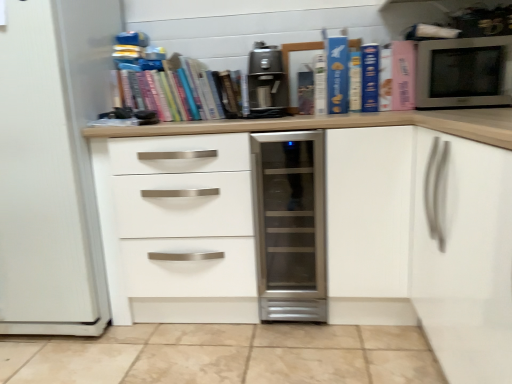
Describe the element at coordinates (370, 78) in the screenshot. The height and width of the screenshot is (384, 512). I see `blue matte book at upper center, which ranks as the 3th paperback book in right-to-left order` at that location.

What do you see at coordinates (305, 92) in the screenshot? I see `matte paper at center, arranged as the seventh paperback book when viewed from the right` at bounding box center [305, 92].

Describe the element at coordinates (172, 89) in the screenshot. I see `hardcover books at upper center` at that location.

Where is `satin silver microwave at upper right`? The height and width of the screenshot is (384, 512). satin silver microwave at upper right is located at coordinates (464, 72).

The width and height of the screenshot is (512, 384). I want to click on satin silver coffee machine at upper center, so click(x=266, y=80).

Describe the element at coordinates (385, 79) in the screenshot. The image size is (512, 384). I see `pink matte book at upper right, acting as the sixth paperback book starting from the left` at that location.

You are a GUI agent. You are given a task and a screenshot of the screen. Output one action in this format:
    pyautogui.click(x=<x>, y=<y>)
    Task: Click on the blue matte book at upper center, which ranks as the 3th paperback book in right-to-left order
    
    Given the screenshot: What is the action you would take?
    pyautogui.click(x=370, y=78)

From a real-world perspective, is blue cardboard book at upper right, which is the 5th paperback book in right-to-left order, physically located above or below blue matte book at upper center, marked as the fourth paperback book in a left-to-right arrangement?

blue cardboard book at upper right, which is the 5th paperback book in right-to-left order, is above blue matte book at upper center, marked as the fourth paperback book in a left-to-right arrangement.

In the scene shown: Which object is thinner, blue cardboard book at upper right, which is the third paperback book from left to right, or blue matte book at upper center, marked as the fourth paperback book in a left-to-right arrangement?

blue cardboard book at upper right, which is the third paperback book from left to right.

Is blue cardboard book at upper right, which is the third paperback book from left to right, far from blue matte book at upper center, placed as the 4th paperback book when sorted from right to left?

No, blue cardboard book at upper right, which is the third paperback book from left to right, is in close proximity to blue matte book at upper center, placed as the 4th paperback book when sorted from right to left.

Considering the relative sizes of blue cardboard book at upper right, which is the third paperback book from left to right, and blue matte book at upper center, placed as the 4th paperback book when sorted from right to left, in the image provided, is blue cardboard book at upper right, which is the third paperback book from left to right, taller than blue matte book at upper center, placed as the 4th paperback book when sorted from right to left,?

Indeed, blue cardboard book at upper right, which is the third paperback book from left to right, has a greater height compared to blue matte book at upper center, placed as the 4th paperback book when sorted from right to left.

Between satin silver refrigerator at center and satin silver coffee machine at upper center, which one has larger size?

With larger size is satin silver refrigerator at center.

What's the angular difference between satin silver refrigerator at center and satin silver coffee machine at upper center's facing directions?

satin silver refrigerator at center and satin silver coffee machine at upper center are facing 0.000573 degrees away from each other.

From a real-world perspective, is satin silver refrigerator at center on satin silver coffee machine at upper center?

No, from a real-world perspective, satin silver refrigerator at center is not above satin silver coffee machine at upper center.

Who is more distant, satin silver refrigerator at center or satin silver coffee machine at upper center?

satin silver coffee machine at upper center is behind.

Consider the image. Which of these two, pink matte book at upper right, the second paperback book when ordered from right to left, or hardcover books at upper center, stands shorter?

Standing shorter between the two is hardcover books at upper center.

Between point (382, 97) and point (205, 91), which one is positioned in front?

The point (382, 97) is in front.

From the image's perspective, is pink matte book at upper right, acting as the sixth paperback book starting from the left, located above or below hardcover books at upper center?

Based on their image positions, pink matte book at upper right, acting as the sixth paperback book starting from the left, is located above hardcover books at upper center.

Can you confirm if pink matte book at upper right, the second paperback book when ordered from right to left, is wider than hardcover books at upper center?

No.

Measure the distance from blue cardboard book at upper right, which is the 5th paperback book in right-to-left order, to pink matte paperback book at upper right, the 7th paperback book from the left.

The distance of blue cardboard book at upper right, which is the 5th paperback book in right-to-left order, from pink matte paperback book at upper right, the 7th paperback book from the left, is 9.94 inches.

From a real-world perspective, is blue cardboard book at upper right, which is the 5th paperback book in right-to-left order, beneath pink matte paperback book at upper right, the 7th paperback book from the left?

No, from a real-world perspective, blue cardboard book at upper right, which is the 5th paperback book in right-to-left order, is not beneath pink matte paperback book at upper right, the 7th paperback book from the left.

You are a GUI agent. You are given a task and a screenshot of the screen. Output one action in this format:
    pyautogui.click(x=<x>, y=<y>)
    Task: Click on the paperback book above the pink matte paperback book at upper right, the first paperback book viewed from the right (from a real-world perspective)
    The image size is (512, 384).
    Given the screenshot: What is the action you would take?
    pyautogui.click(x=337, y=75)

Is blue cardboard book at upper right, which is the 5th paperback book in right-to-left order, bigger than pink matte paperback book at upper right, the 7th paperback book from the left?

Correct, blue cardboard book at upper right, which is the 5th paperback book in right-to-left order, is larger in size than pink matte paperback book at upper right, the 7th paperback book from the left.

Considering the sizes of objects pink matte paperback book at upper right, the first paperback book viewed from the right, and satin silver microwave at upper right in the image provided, who is bigger, pink matte paperback book at upper right, the first paperback book viewed from the right, or satin silver microwave at upper right?

satin silver microwave at upper right is bigger.

How different are the orientations of pink matte paperback book at upper right, the 7th paperback book from the left, and satin silver microwave at upper right in degrees?

The facing directions of pink matte paperback book at upper right, the 7th paperback book from the left, and satin silver microwave at upper right are 1.15 degrees apart.

From their relative heights in the image, would you say pink matte paperback book at upper right, the first paperback book viewed from the right, is taller or shorter than satin silver microwave at upper right?

pink matte paperback book at upper right, the first paperback book viewed from the right, is taller than satin silver microwave at upper right.

Does pink matte paperback book at upper right, the 7th paperback book from the left, have a lesser width compared to satin silver microwave at upper right?

Indeed, pink matte paperback book at upper right, the 7th paperback book from the left, has a lesser width compared to satin silver microwave at upper right.

Which is behind, point (239, 182) or point (310, 76)?

The point (310, 76) is behind.

How much distance is there between white matte drawer at center and matte paper at center, which appears as the 1th paperback book when viewed from the left?

white matte drawer at center is 78.66 centimeters away from matte paper at center, which appears as the 1th paperback book when viewed from the left.

Is white matte drawer at center next to matte paper at center, which appears as the 1th paperback book when viewed from the left?

No.

Is the depth of white matte drawer at center less than that of matte paper at center, which appears as the 1th paperback book when viewed from the left?

Yes, it is.

From a real-world perspective, is hardcover books at upper center positioned under matte paper at center, arranged as the seventh paperback book when viewed from the right, based on gravity?

No, from a real-world perspective, hardcover books at upper center is not beneath matte paper at center, arranged as the seventh paperback book when viewed from the right.

Considering the positions of objects hardcover books at upper center and matte paper at center, arranged as the seventh paperback book when viewed from the right, in the image provided, who is more to the left, hardcover books at upper center or matte paper at center, arranged as the seventh paperback book when viewed from the right,?

From the viewer's perspective, hardcover books at upper center appears more on the left side.

Can you confirm if hardcover books at upper center is thinner than matte paper at center, arranged as the seventh paperback book when viewed from the right?

No.

Is hardcover books at upper center in contact with matte paper at center, which appears as the 1th paperback book when viewed from the left?

No, hardcover books at upper center is not with matte paper at center, which appears as the 1th paperback book when viewed from the left.

From a real-world perspective, which paperback book is the 4th one underneath the blue cardboard book at upper right, which is the third paperback book from left to right? Please provide its 2D coordinates.

[(355, 82)]

I want to click on home appliance that appears on the right of satin silver coffee machine at upper center, so click(x=291, y=225).

Based on their spatial positions, is satin silver coffee machine at upper center or hardcover book at center, arranged as the 6th paperback book when viewed from the right, further from matte paper at center, which appears as the 1th paperback book when viewed from the left?

satin silver coffee machine at upper center lies further to matte paper at center, which appears as the 1th paperback book when viewed from the left, than the other object.

Considering their positions, is pink matte book at upper right, the second paperback book when ordered from right to left, positioned closer to blue cardboard book at upper right, which is the third paperback book from left to right, than satin silver coffee machine at upper center?

The object closer to blue cardboard book at upper right, which is the third paperback book from left to right, is pink matte book at upper right, the second paperback book when ordered from right to left.

When comparing their distances from matte paper at center, arranged as the seventh paperback book when viewed from the right, does hardcover books at upper center or hardcover book at center, which appears as the second paperback book when viewed from the left, seem further?

The object further to matte paper at center, arranged as the seventh paperback book when viewed from the right, is hardcover books at upper center.

Based on their spatial positions, is pink matte paperback book at upper right, the 7th paperback book from the left, or satin silver refrigerator at center closer to white matte drawer at center?

satin silver refrigerator at center is positioned closer to the anchor white matte drawer at center.

Estimate the real-world distances between objects in this image. Which object is further from matte paper at center, arranged as the seventh paperback book when viewed from the right, hardcover books at upper center or blue matte book at upper center, acting as the fifth paperback book starting from the left?

The object further to matte paper at center, arranged as the seventh paperback book when viewed from the right, is hardcover books at upper center.

When comparing their distances from pink matte book at upper right, acting as the sixth paperback book starting from the left, does hardcover books at upper center or blue matte book at upper center, marked as the fourth paperback book in a left-to-right arrangement, seem closer?

Among the two, blue matte book at upper center, marked as the fourth paperback book in a left-to-right arrangement, is located nearer to pink matte book at upper right, acting as the sixth paperback book starting from the left.

When comparing their distances from satin silver coffee machine at upper center, does pink matte book at upper right, the second paperback book when ordered from right to left, or hardcover books at upper center seem further?

The object further to satin silver coffee machine at upper center is pink matte book at upper right, the second paperback book when ordered from right to left.

In the scene shown: Which object lies further to the anchor point pink matte paperback book at upper right, the first paperback book viewed from the right, blue matte book at upper center, which ranks as the 3th paperback book in right-to-left order, or white matte drawer at center?

The object further to pink matte paperback book at upper right, the first paperback book viewed from the right, is white matte drawer at center.

You are a GUI agent. You are given a task and a screenshot of the screen. Output one action in this format:
    pyautogui.click(x=<x>, y=<y>)
    Task: Click on the drawer that lies between hardcover book at center, which appears as the second paperback book when viewed from the left, and satin silver refrigerator at center from top to bottom
    The height and width of the screenshot is (384, 512).
    Given the screenshot: What is the action you would take?
    pyautogui.click(x=184, y=215)

Where is `paperback book between blue matte book at upper center, marked as the fourth paperback book in a left-to-right arrangement, and pink matte book at upper right, the second paperback book when ordered from right to left, from left to right`? The width and height of the screenshot is (512, 384). paperback book between blue matte book at upper center, marked as the fourth paperback book in a left-to-right arrangement, and pink matte book at upper right, the second paperback book when ordered from right to left, from left to right is located at coordinates (370, 78).

Locate an element on the screen. home appliance between white matte drawer at center and pink matte book at upper right, the second paperback book when ordered from right to left, from left to right is located at coordinates (291, 225).

This screenshot has height=384, width=512. What are the coordinates of `home appliance between white matte drawer at center and blue matte book at upper center, which ranks as the 3th paperback book in right-to-left order, from left to right` in the screenshot? It's located at (291, 225).